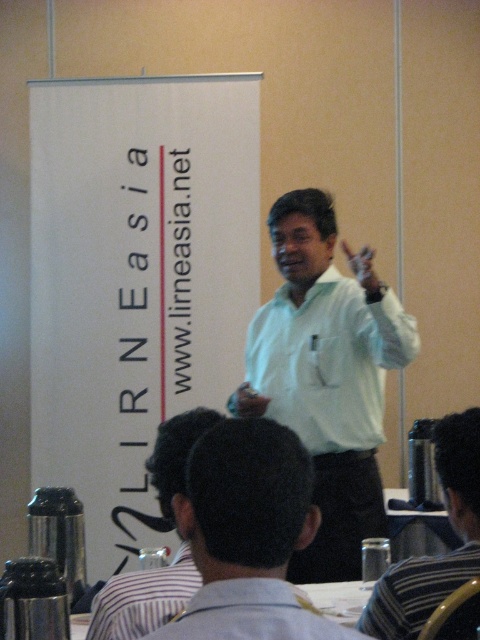
Question: Can you confirm if white matte shirt at center is bigger than striped shirt at center?

Choices:
 (A) yes
 (B) no

Answer: (A)

Question: Which object appears closest to the camera in this image?

Choices:
 (A) white shirt at center
 (B) white matte shirt at center

Answer: (A)

Question: Does white shirt at center lie in front of white matte shirt at center?

Choices:
 (A) no
 (B) yes

Answer: (B)

Question: Can you confirm if white matte shirt at center is wider than striped shirt at center?

Choices:
 (A) yes
 (B) no

Answer: (A)

Question: Which is nearer to the light green shirt at center?

Choices:
 (A) white matte shirt at center
 (B) striped shirt at center
 (C) white shirt at center
 (D) striped fabric shirt at center

Answer: (A)

Question: Among these points, which one is farthest from the camera?

Choices:
 (A) (405, 605)
 (B) (207, 612)
 (C) (308, 556)
 (D) (356, 368)

Answer: (C)